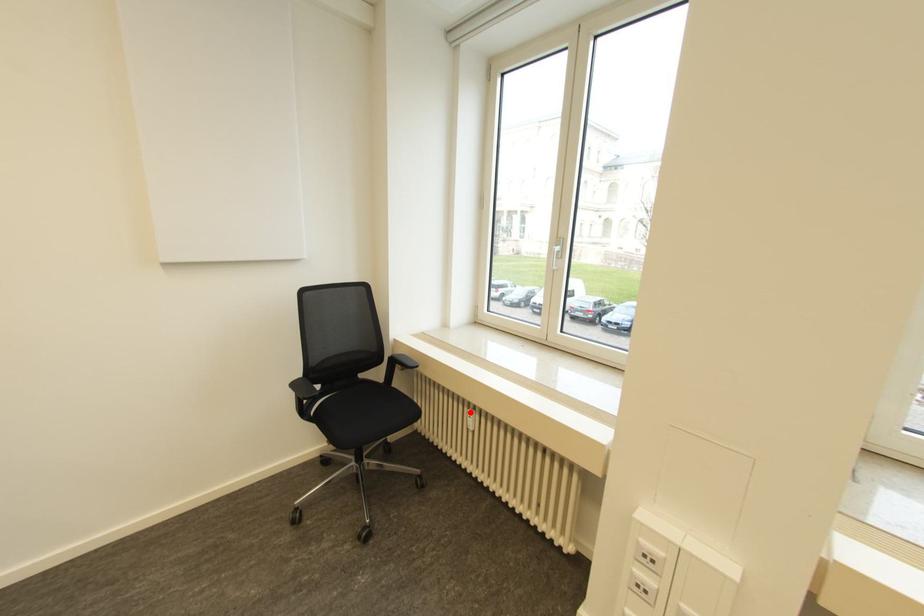
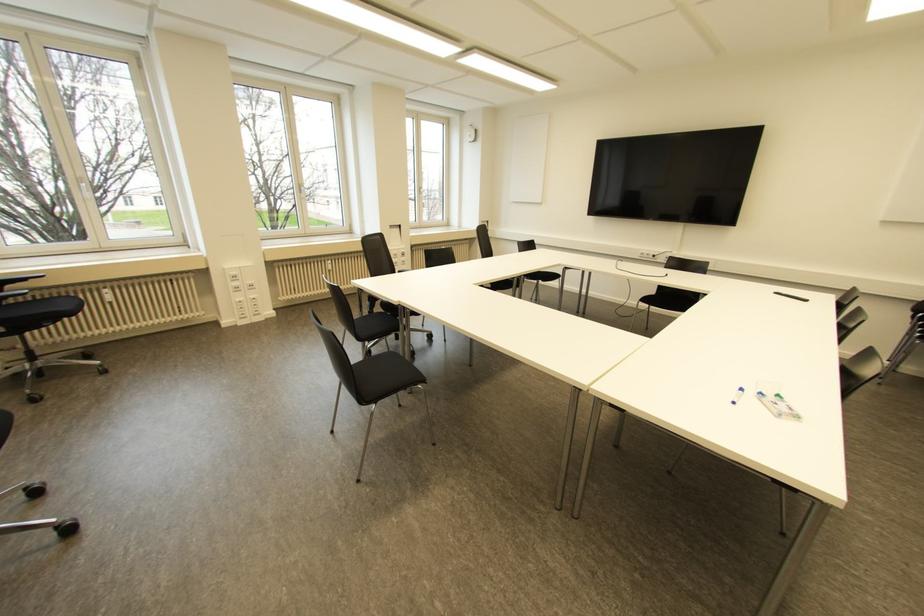
The point at the highlighted location is marked in the first image. Where is the corresponding point in the second image?

(104, 290)